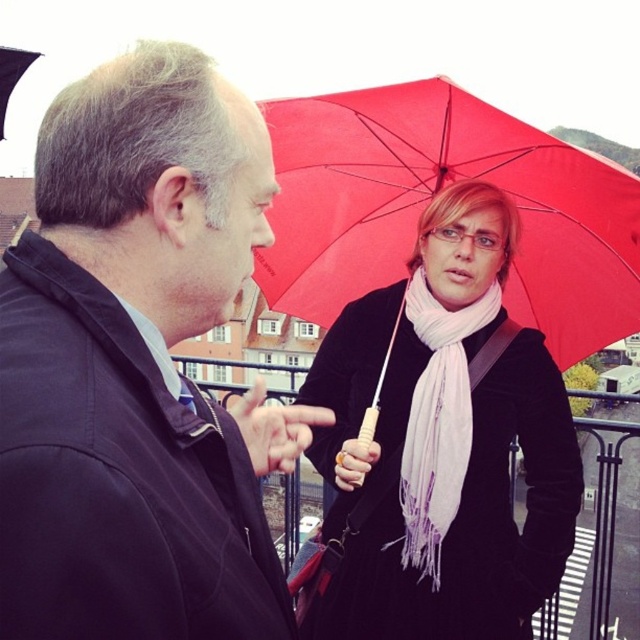
Question: Which point appears farthest from the camera in this image?

Choices:
 (A) (42, 428)
 (B) (435, 420)
 (C) (380, 164)
 (D) (563, 385)

Answer: (C)

Question: Based on their relative distances, which object is nearer to the red matte umbrella at upper right?

Choices:
 (A) matte black jacket at left
 (B) white soft scarf at center

Answer: (B)

Question: Is matte black jacket at left closer to the viewer compared to red matte umbrella at upper right?

Choices:
 (A) yes
 (B) no

Answer: (A)

Question: Is pink scarf at upper right wider than white soft scarf at center?

Choices:
 (A) no
 (B) yes

Answer: (B)

Question: Can you confirm if pink scarf at upper right is positioned to the right of white soft scarf at center?

Choices:
 (A) yes
 (B) no

Answer: (B)

Question: Estimate the real-world distances between objects in this image. Which object is farther from the matte black jacket at left?

Choices:
 (A) pink scarf at upper right
 (B) white soft scarf at center
 (C) red matte umbrella at upper right

Answer: (C)